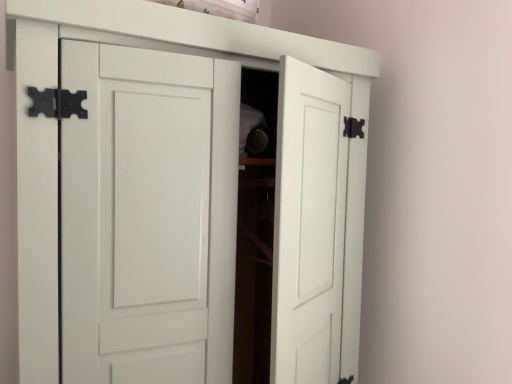
Question: Is white matte shelf at upper center shorter than white matte cupboard at center?

Choices:
 (A) yes
 (B) no

Answer: (A)

Question: Is white matte shelf at upper center with white matte cupboard at center?

Choices:
 (A) no
 (B) yes

Answer: (B)

Question: Considering the relative sizes of white matte shelf at upper center and white matte cupboard at center in the image provided, is white matte shelf at upper center thinner than white matte cupboard at center?

Choices:
 (A) no
 (B) yes

Answer: (B)

Question: Does white matte shelf at upper center have a larger size compared to white matte cupboard at center?

Choices:
 (A) no
 (B) yes

Answer: (A)

Question: From a real-world perspective, is white matte shelf at upper center beneath white matte cupboard at center?

Choices:
 (A) no
 (B) yes

Answer: (A)

Question: Is white matte shelf at upper center oriented towards white matte cupboard at center?

Choices:
 (A) yes
 (B) no

Answer: (B)

Question: Does white matte cupboard at center have a lesser width compared to white matte shelf at upper center?

Choices:
 (A) no
 (B) yes

Answer: (A)

Question: Is white matte cupboard at center surrounding white matte shelf at upper center?

Choices:
 (A) yes
 (B) no

Answer: (B)

Question: Is white matte cupboard at center closer to camera compared to white matte shelf at upper center?

Choices:
 (A) yes
 (B) no

Answer: (A)

Question: Considering the relative sizes of white matte cupboard at center and white matte shelf at upper center in the image provided, is white matte cupboard at center smaller than white matte shelf at upper center?

Choices:
 (A) yes
 (B) no

Answer: (B)

Question: Is the position of white matte cupboard at center more distant than that of white matte shelf at upper center?

Choices:
 (A) yes
 (B) no

Answer: (B)

Question: Is white matte cupboard at center facing away from white matte shelf at upper center?

Choices:
 (A) yes
 (B) no

Answer: (B)

Question: From the image's perspective, is white matte cupboard at center located above or below white matte shelf at upper center?

Choices:
 (A) above
 (B) below

Answer: (B)